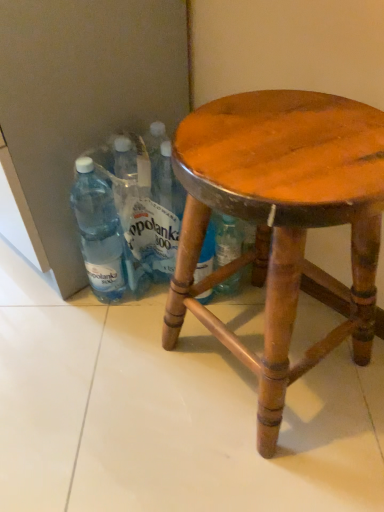
Find the location of a particular element. free location to the left of transparent plastic bottle at left is located at coordinates (36, 300).